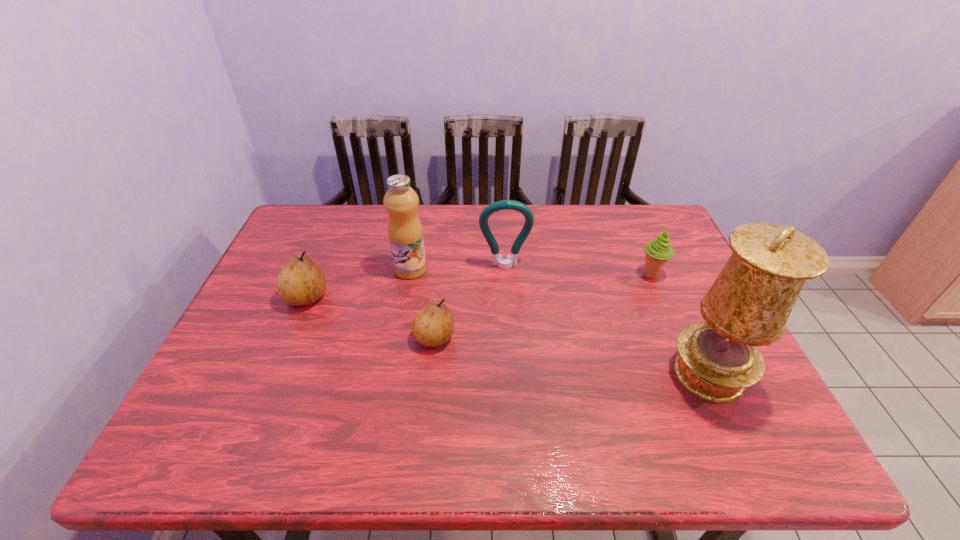
Where is `the farther pear`? Image resolution: width=960 pixels, height=540 pixels. the farther pear is located at coordinates (301, 282).

Find the location of a particular element. This screenshot has width=960, height=540. the left pear is located at coordinates (301, 282).

This screenshot has height=540, width=960. What are the coordinates of `the shortest object` in the screenshot? It's located at (433, 326).

Find the location of `the right pear`. the right pear is located at coordinates (433, 326).

This screenshot has width=960, height=540. Find the location of `the third object from right to left`. the third object from right to left is located at coordinates (497, 260).

The height and width of the screenshot is (540, 960). I want to click on the third tallest object, so click(497, 260).

Identify the location of icecream. (658, 251).

Locate an element on the screen. The width and height of the screenshot is (960, 540). fruit juice is located at coordinates (405, 232).

Find the location of a particular element. The height and width of the screenshot is (540, 960). oil lamp is located at coordinates (748, 305).

At what (x,y) coordinates should I click in order to perform the action: click on free space located 0.160m on the back of the leftmost object. Please return your answer as a coordinate pair (x, y). The image size is (960, 540). Looking at the image, I should click on (327, 248).